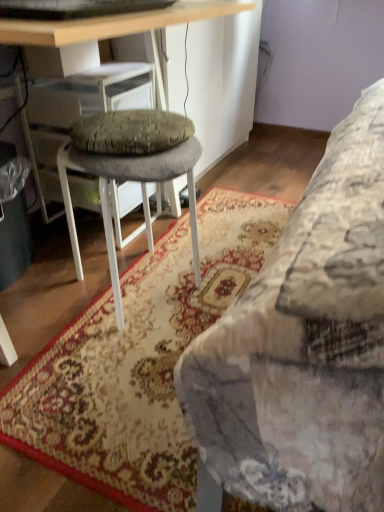
What do you see at coordinates (130, 170) in the screenshot?
I see `gray fabric stool at center` at bounding box center [130, 170].

Where is `gray fabric stool at center`? gray fabric stool at center is located at coordinates (130, 170).

Is gray fabric stool at center in front of wooden desk at center?

No, it is not.

Which is more to the left, gray fabric stool at center or wooden desk at center?

From the viewer's perspective, wooden desk at center appears more on the left side.

Is gray fabric stool at center placed right next to wooden desk at center?

No, gray fabric stool at center is not beside wooden desk at center.

Which is in front, point (192, 137) or point (149, 412)?

Point (149, 412)

Considering the sizes of objects gray fabric stool at center and floral carpet at lower right in the image provided, who is bigger, gray fabric stool at center or floral carpet at lower right?

gray fabric stool at center.

Is gray fabric stool at center to the right of floral carpet at lower right from the viewer's perspective?

No, gray fabric stool at center is not to the right of floral carpet at lower right.

From the image's perspective, is gray fabric stool at center located above or below floral carpet at lower right?

gray fabric stool at center is above floral carpet at lower right.

Is wooden desk at center taller or shorter than floral carpet at lower right?

wooden desk at center is taller than floral carpet at lower right.

Is wooden desk at center further to the viewer compared to floral carpet at lower right?

No, wooden desk at center is closer to the camera.

From the image's perspective, is wooden desk at center under floral carpet at lower right?

No.

Consider the image. Is wooden desk at center positioned with its back to floral carpet at lower right?

No, wooden desk at center is not facing away from floral carpet at lower right.

Who is bigger, floral carpet at lower right or gray fabric stool at center?

With larger size is gray fabric stool at center.

Considering their positions, is floral carpet at lower right located in front of or behind gray fabric stool at center?

floral carpet at lower right is positioned closer to the viewer than gray fabric stool at center.

Is floral carpet at lower right looking in the opposite direction of gray fabric stool at center?

No, floral carpet at lower right's orientation is not away from gray fabric stool at center.

Measure the distance from floral carpet at lower right to gray fabric stool at center.

They are 29.14 centimeters apart.

Which object is closer to the camera taking this photo, wooden desk at center or gray fabric stool at center?

wooden desk at center is more forward.

From a real-world perspective, is wooden desk at center located beneath gray fabric stool at center?

No, from a real-world perspective, wooden desk at center is not beneath gray fabric stool at center.

Do you think wooden desk at center is within gray fabric stool at center, or outside of it?

wooden desk at center lies outside gray fabric stool at center.

Is floral carpet at lower right at the right side of wooden desk at center?

Yes, floral carpet at lower right is to the right of wooden desk at center.

From their relative heights in the image, would you say floral carpet at lower right is taller or shorter than wooden desk at center?

Considering their sizes, floral carpet at lower right has less height than wooden desk at center.

Is floral carpet at lower right oriented towards wooden desk at center?

No, floral carpet at lower right is not aimed at wooden desk at center.

Find the location of `stool that is on the right side of wooden desk at center`. stool that is on the right side of wooden desk at center is located at coordinates 130,170.

At what (x,y) coordinates should I click in order to perform the action: click on mat in front of the gray fabric stool at center. Please return your answer as a coordinate pair (x, y). Looking at the image, I should click on (139, 361).

Estimate the real-world distances between objects in this image. Which object is closer to gray fabric stool at center, wooden desk at center or floral carpet at lower right?

Among the two, floral carpet at lower right is located nearer to gray fabric stool at center.

Considering their positions, is floral carpet at lower right positioned further to gray fabric stool at center than wooden desk at center?

Among the two, wooden desk at center is located further to gray fabric stool at center.

Based on their spatial positions, is wooden desk at center or gray fabric stool at center further from floral carpet at lower right?

The object further to floral carpet at lower right is wooden desk at center.

Considering their positions, is gray fabric stool at center positioned further to wooden desk at center than floral carpet at lower right?

Among the two, floral carpet at lower right is located further to wooden desk at center.

Which object lies further to the anchor point wooden desk at center, floral carpet at lower right or gray fabric stool at center?

The object further to wooden desk at center is floral carpet at lower right.

From the image, which object appears to be nearer to floral carpet at lower right, gray fabric stool at center or wooden desk at center?

gray fabric stool at center.

The image size is (384, 512). Find the location of `stool between wooden desk at center and floral carpet at lower right in the vertical direction`. stool between wooden desk at center and floral carpet at lower right in the vertical direction is located at coordinates (130, 170).